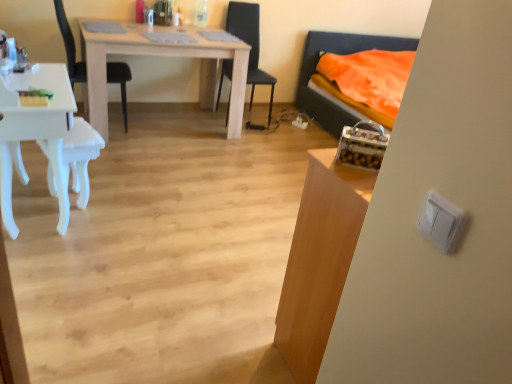
At what (x,y) coordinates should I click in order to perform the action: click on free space above light wood table at center, arranged as the 2th table when viewed from the right (from a real-world perspective). Please return your answer as a coordinate pair (x, y). The width and height of the screenshot is (512, 384). Looking at the image, I should click on (178, 34).